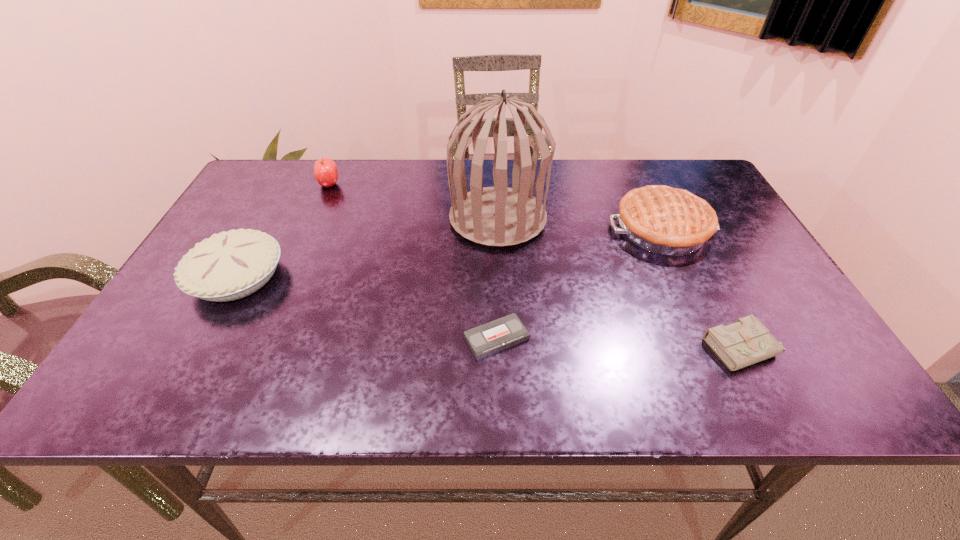
At what (x,y) coordinates should I click in order to perform the action: click on vacant area that lies between the apple and the shorter pie. Please return your answer as a coordinate pair (x, y). Image resolution: width=960 pixels, height=540 pixels. Looking at the image, I should click on [283, 231].

I want to click on vacant area that lies between the apple and the birdcage, so click(x=414, y=201).

Locate an element on the screen. vacant area that lies between the birdcage and the taller pie is located at coordinates (580, 224).

This screenshot has height=540, width=960. What are the coordinates of `free space between the apple and the left pie` in the screenshot? It's located at tap(283, 231).

This screenshot has width=960, height=540. Find the location of `free space between the diary and the shorter pie`. free space between the diary and the shorter pie is located at coordinates (492, 312).

I want to click on free space between the shortest object and the birdcage, so click(x=497, y=278).

Identify the location of object identified as the closest to the apple. (231, 265).

Image resolution: width=960 pixels, height=540 pixels. Find the location of `object that is the closest one to the taller pie`. object that is the closest one to the taller pie is located at coordinates (499, 216).

The height and width of the screenshot is (540, 960). What are the coordinates of `blank area in the image that satisfies the following two spatial constraints: 1. on the back side of the shorter pie; 2. on the left side of the apple` in the screenshot? It's located at (287, 185).

Locate an element on the screen. The width and height of the screenshot is (960, 540). vacant space that satisfies the following two spatial constraints: 1. on the front side of the birdcage; 2. on the left side of the fifth tallest object is located at coordinates (504, 348).